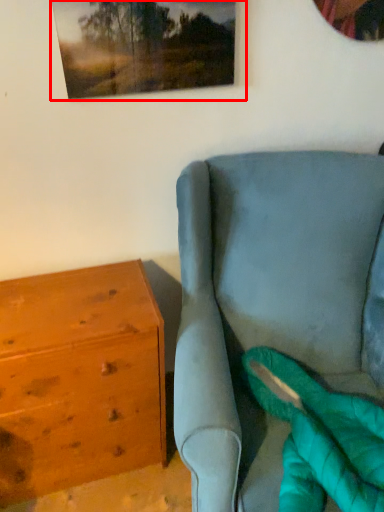
Question: From the image's perspective, where is picture frame (annotated by the red box) located in relation to chest of drawers in the image?

Choices:
 (A) below
 (B) above

Answer: (B)